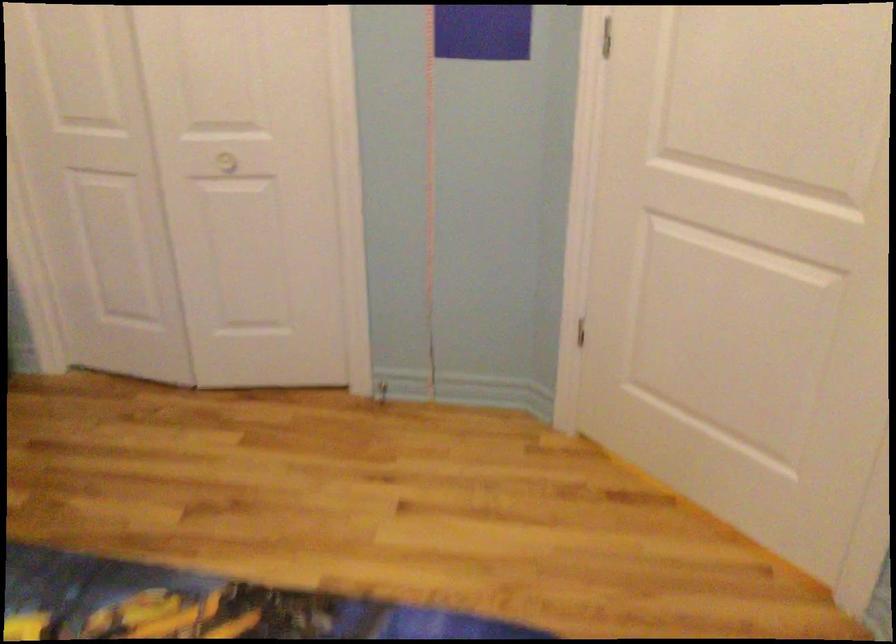
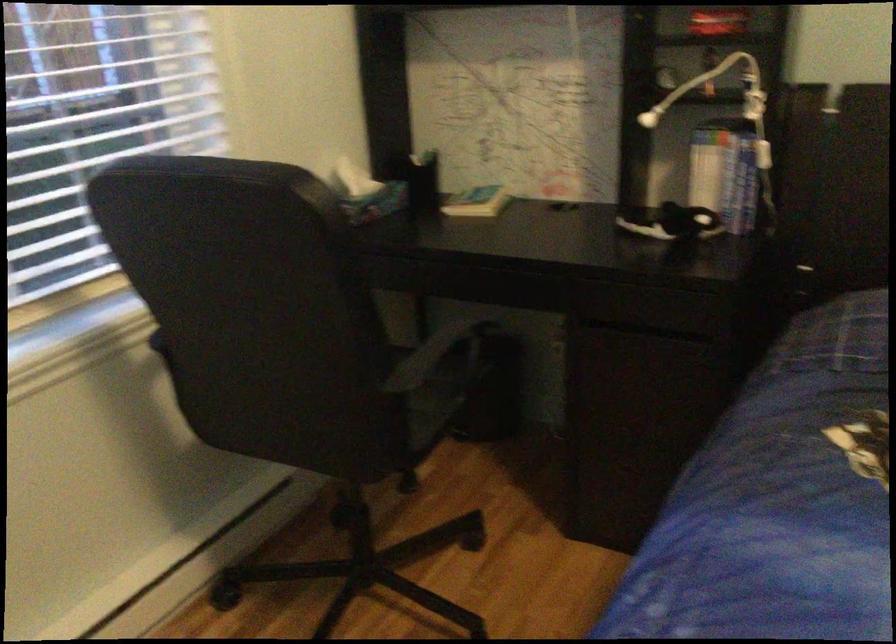
Based on the continuous images, in which direction is the camera rotating?

The camera's rotation is toward left-down.